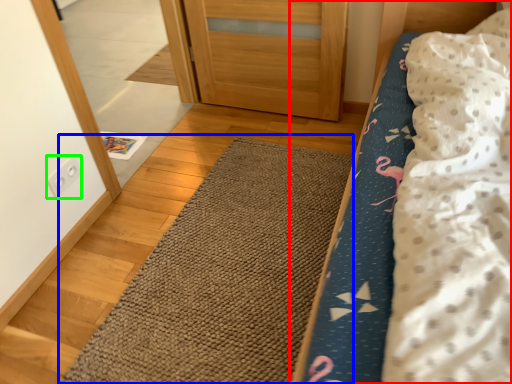
Question: Which object is the closest to the bed (highlighted by a red box)? Choose among these: doormat (highlighted by a blue box) or electric outlet (highlighted by a green box).

Choices:
 (A) doormat
 (B) electric outlet

Answer: (A)